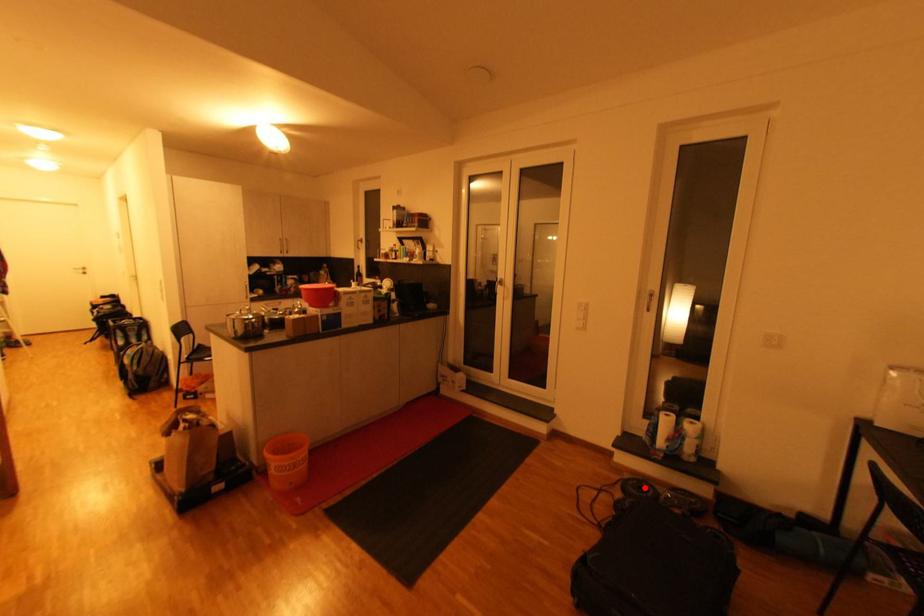
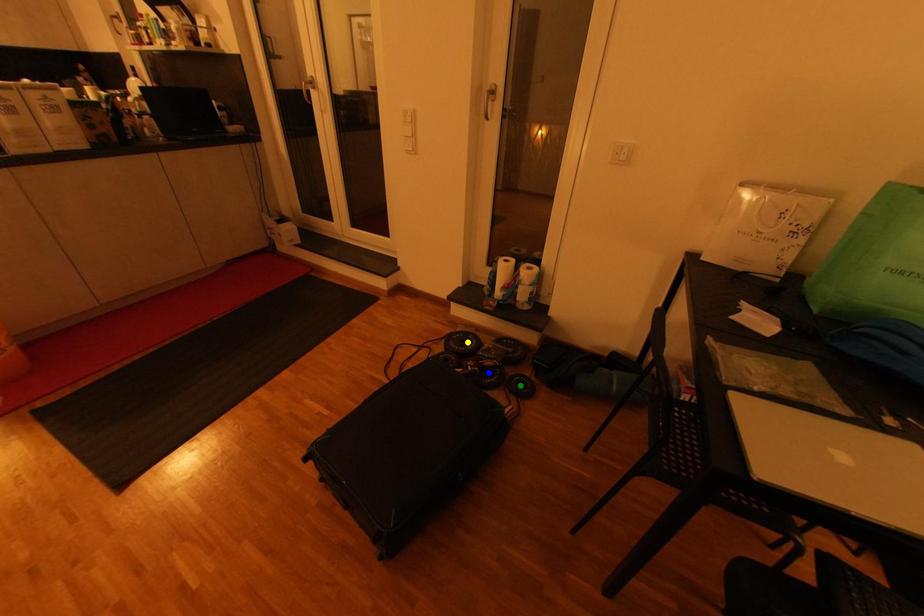
Question: I am providing you with two images of the same scene from different viewpoints. A red point is marked on the first image. You are given multiple points on the second image. In image 2, which mark is for the same physical point as the one in image 1?

Choices:
 (A) yellow point
 (B) green point
 (C) blue point

Answer: (A)